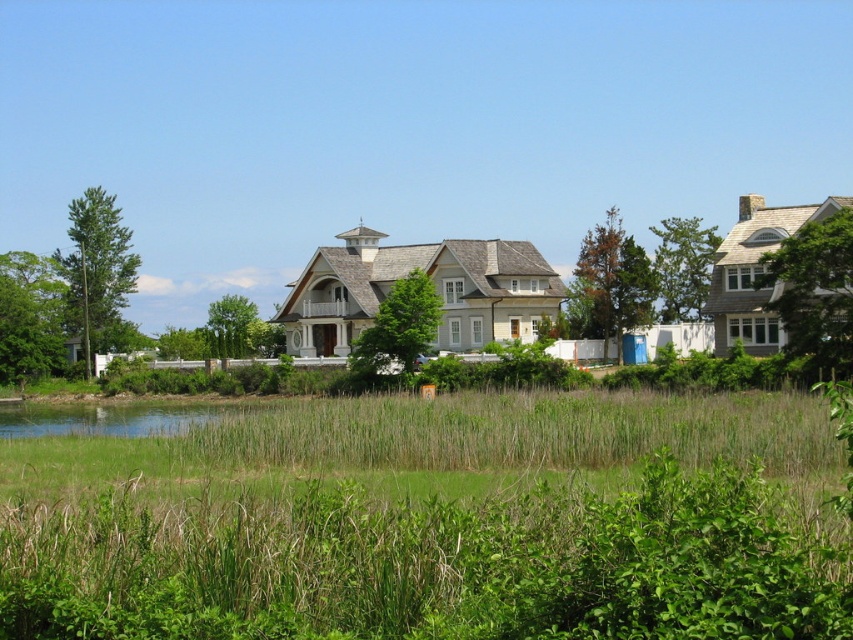
Question: Does green grass at center have a larger size compared to clear water at lower left?

Choices:
 (A) no
 (B) yes

Answer: (A)

Question: Does green grass at center appear on the left side of clear water at lower left?

Choices:
 (A) no
 (B) yes

Answer: (A)

Question: From the image, what is the correct spatial relationship of green grass at center in relation to clear water at lower left?

Choices:
 (A) above
 (B) below

Answer: (A)

Question: Among these objects, which one is nearest to the camera?

Choices:
 (A) clear water at lower left
 (B) green grass at center

Answer: (B)

Question: Which point appears farthest from the camera in this image?

Choices:
 (A) (819, 561)
 (B) (73, 416)

Answer: (B)

Question: Which of the following is the closest to the observer?

Choices:
 (A) clear water at lower left
 (B) green grass at center

Answer: (B)